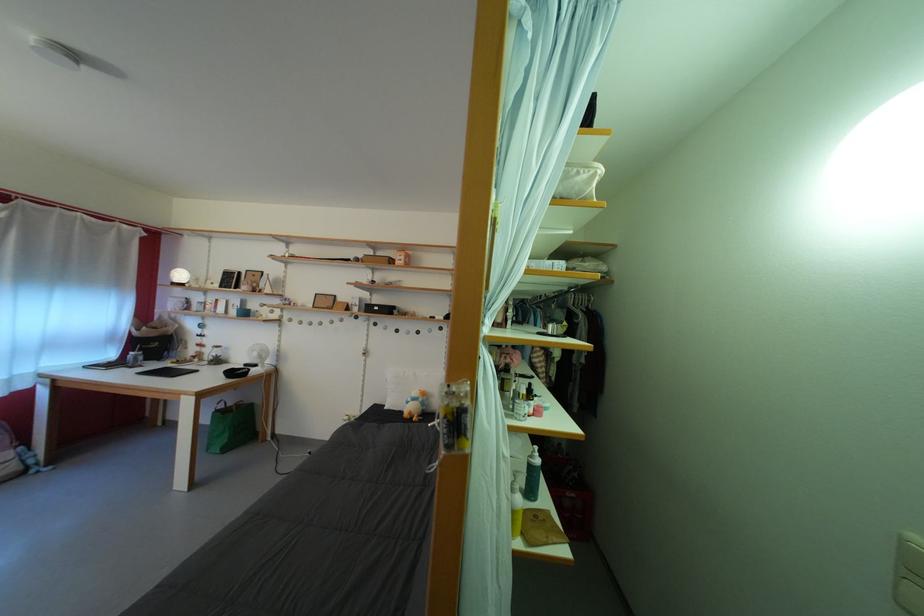
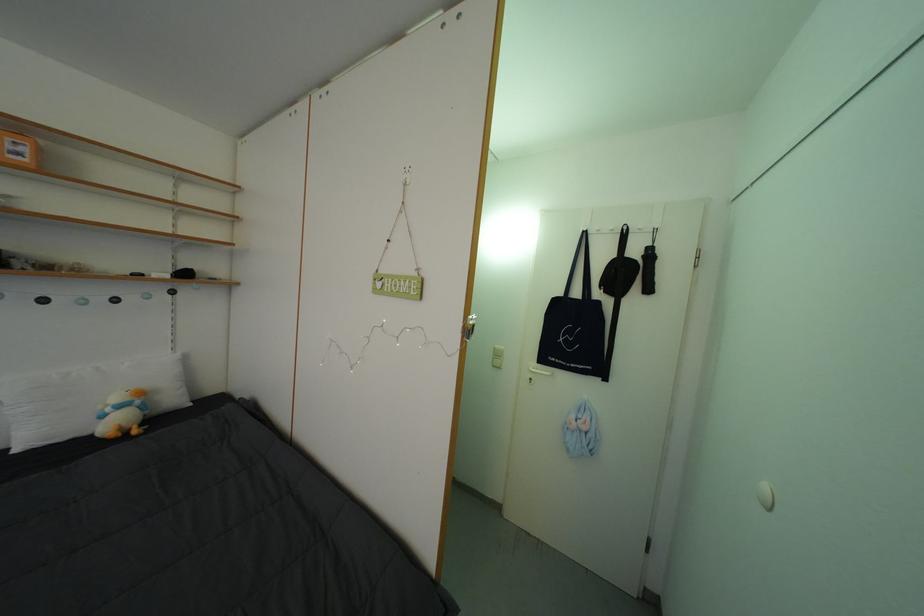
The point at [431,410] is marked in the first image. Where is the corresponding point in the second image?

(152, 413)